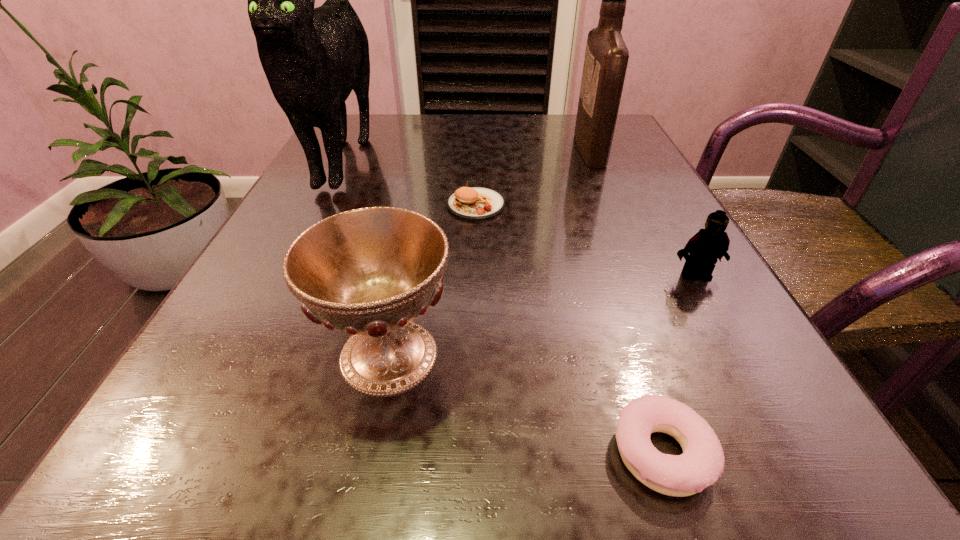
What are the coordinates of `chalice positioned at the left edge` in the screenshot? It's located at (370, 272).

Where is `liquor present at the right edge`? The height and width of the screenshot is (540, 960). liquor present at the right edge is located at coordinates (606, 58).

This screenshot has width=960, height=540. Find the location of `Lego that is at the right edge`. Lego that is at the right edge is located at coordinates (708, 245).

At what (x,y) coordinates should I click in order to perform the action: click on doughnut at the right edge. Please return your answer as a coordinate pair (x, y). This screenshot has height=540, width=960. Looking at the image, I should click on (701, 464).

This screenshot has width=960, height=540. I want to click on object located at the far left corner, so click(313, 58).

At what (x,y) coordinates should I click in order to perform the action: click on object situated at the far right corner. Please return your answer as a coordinate pair (x, y). Looking at the image, I should click on tap(606, 58).

I want to click on object at the near right corner, so click(x=701, y=464).

Where is `vacant area at the far edge of the desktop`? vacant area at the far edge of the desktop is located at coordinates (522, 153).

Find the location of `vacant space at the near edge`. vacant space at the near edge is located at coordinates (630, 485).

At what (x,y) coordinates should I click in order to perform the action: click on free region at the left edge. Please return your answer as a coordinate pair (x, y). This screenshot has width=960, height=540. Looking at the image, I should click on (263, 247).